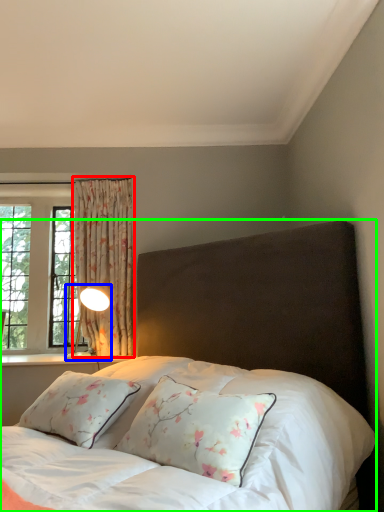
Question: Estimate the real-world distances between objects in this image. Which object is farther from curtain (highlighted by a red box), table lamp (highlighted by a blue box) or bed (highlighted by a green box)?

Choices:
 (A) table lamp
 (B) bed

Answer: (B)